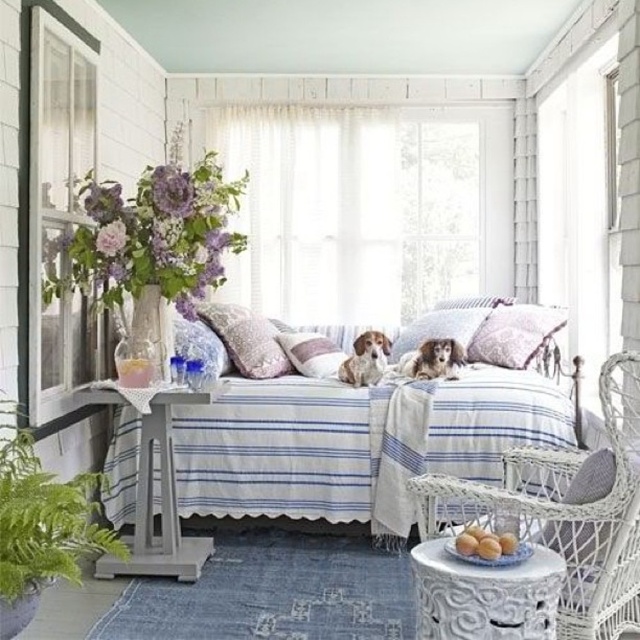
Question: Among these points, which one is farthest from the camera?

Choices:
 (A) (81, 250)
 (B) (429, 339)

Answer: (B)

Question: From the image, what is the correct spatial relationship of matte glass vase at left in relation to shiny brown fur at center?

Choices:
 (A) below
 (B) above

Answer: (B)

Question: Can you confirm if textured lavender pillow at center is positioned to the right of white fur dog at center?

Choices:
 (A) yes
 (B) no

Answer: (B)

Question: Based on their relative distances, which object is nearer to the green leafy plant at lower left?

Choices:
 (A) white sheer curtain at upper center
 (B) fluffy pink pillow at center
 (C) white wicker chair at lower right

Answer: (C)

Question: Estimate the real-world distances between objects in this image. Which object is closer to the green leafy plant at lower left?

Choices:
 (A) white striped fabric bed at center
 (B) pink textured pillow at center
 (C) white sheer curtain at upper center

Answer: (A)

Question: Is white wicker chair at lower right to the left of green leafy plant at lower left from the viewer's perspective?

Choices:
 (A) no
 (B) yes

Answer: (A)